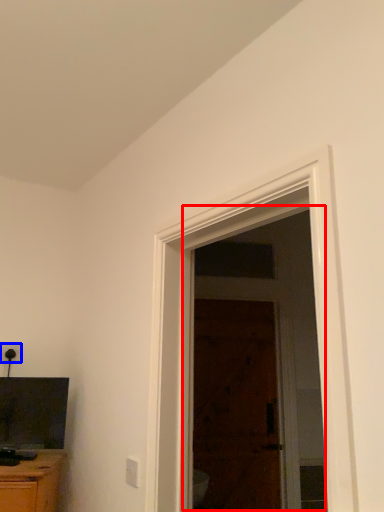
Question: Among these objects, which one is farthest to the camera, screen door (highlighted by a red box) or electric outlet (highlighted by a blue box)?

Choices:
 (A) screen door
 (B) electric outlet

Answer: (A)